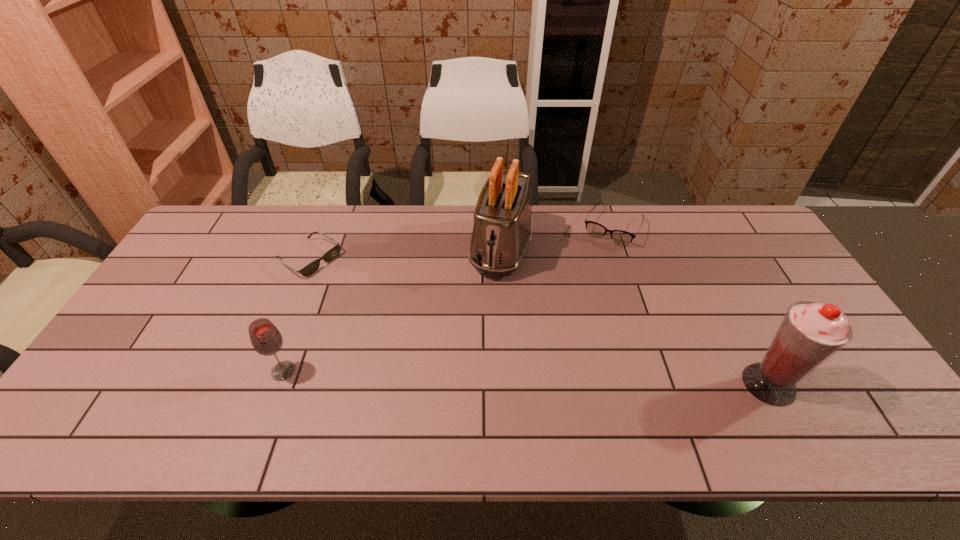
You are a GUI agent. You are given a task and a screenshot of the screen. Output one action in this format:
    pyautogui.click(x=<x>, y=<y>)
    Task: Click on the free space between the fourth tallest object and the smoothie
    
    Given the screenshot: What is the action you would take?
    pyautogui.click(x=690, y=306)

Find the location of a particular element. This screenshot has width=960, height=540. vacant point located between the sunglasses and the spectacles is located at coordinates (461, 243).

Locate an element on the screen. The height and width of the screenshot is (540, 960). free spot between the shortest object and the second object from right to left is located at coordinates (461, 243).

The width and height of the screenshot is (960, 540). Identify the location of free space between the toaster and the glass drink container. tap(393, 309).

The image size is (960, 540). What are the coordinates of `empty space between the third object from right to left and the sunglasses` in the screenshot? It's located at (405, 253).

You are a GUI agent. You are given a task and a screenshot of the screen. Output one action in this format:
    pyautogui.click(x=<x>, y=<y>)
    Task: Click on the unoccupied area between the third shortest object and the spectacles
    The image size is (960, 540).
    Given the screenshot: What is the action you would take?
    point(448,299)

This screenshot has height=540, width=960. What are the coordinates of `blank region between the shortest object and the toaster` in the screenshot? It's located at (405, 253).

Locate which object is the closest to the glass drink container. Please provide its 2D coordinates. Your answer should be formatted as a tuple, i.e. [(x, y)], where the tuple contains the x and y coordinates of a point satisfying the conditions above.

[(333, 252)]

Identify which object is the second nearest to the shortest object. Please provide its 2D coordinates. Your answer should be formatted as a tuple, i.e. [(x, y)], where the tuple contains the x and y coordinates of a point satisfying the conditions above.

[(502, 228)]

At what (x,y) coordinates should I click in order to perform the action: click on free space in the image that satisfies the following two spatial constraints: 1. on the back side of the shortest object; 2. on the right side of the second object from right to left. Please return your answer as a coordinate pair (x, y). The width and height of the screenshot is (960, 540). Looking at the image, I should click on (322, 227).